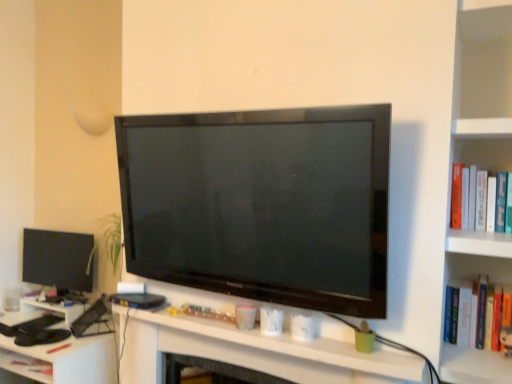
You are a GUI agent. You are given a task and a screenshot of the screen. Output one action in this format:
    pyautogui.click(x=<x>, y=<y>)
    Task: Click on the hardcover book at right
    This screenshot has height=384, width=512.
    Given the screenshot: What is the action you would take?
    pyautogui.click(x=480, y=201)

Measure the distance between point [57,376] and camera.

Point [57,376] and camera are 6.20 feet apart.

Where is `matte black computer at center`? matte black computer at center is located at coordinates (257, 352).

Between matte black monitor at left and white plastic computer desk at lower left, which one is positioned in front?

white plastic computer desk at lower left is more forward.

Between matte black monitor at left and white plastic computer desk at lower left, which one has more height?

white plastic computer desk at lower left is taller.

Is white plastic computer desk at lower left at the back of matte black monitor at left?

matte black monitor at left is not turned away from white plastic computer desk at lower left.

Looking at this image, from the image's perspective, is matte black monitor at left below white plastic computer desk at lower left?

No, from the image's perspective, matte black monitor at left is not below white plastic computer desk at lower left.

Is point (55, 256) behind point (485, 226)?

Yes, point (55, 256) is behind point (485, 226).

Which of these two, matte black monitor at left or hardcover book at right, stands taller?

matte black monitor at left is taller.

Is matte black monitor at left far away from hardcover book at right?

Yes, matte black monitor at left and hardcover book at right are located far from each other.

Considering the relative sizes of matte black monitor at left and hardcover book at right in the image provided, is matte black monitor at left smaller than hardcover book at right?

No, matte black monitor at left is not smaller than hardcover book at right.

Is white plastic computer desk at lower left with hardcover book at right?

There is a gap between white plastic computer desk at lower left and hardcover book at right.

Would you say hardcover book at right is part of white plastic computer desk at lower left's contents?

No, hardcover book at right is not a part of white plastic computer desk at lower left.

From the image's perspective, which is above, white plastic computer desk at lower left or hardcover book at right?

From the image's view, hardcover book at right is above.

Is hardcover book at right situated inside matte black computer at center or outside?

hardcover book at right is not inside matte black computer at center, it's outside.

From the picture: Is hardcover book at right further to camera compared to matte black computer at center?

Yes, hardcover book at right is further from the viewer.

Is matte black computer at center at the back of hardcover book at right?

No, matte black computer at center is not at the back of hardcover book at right.

At what (x,y) coordinates should I click in order to perform the action: click on computer on the left of hardcover book at right. Please return your answer as a coordinate pair (x, y). The image size is (512, 384). Looking at the image, I should click on (257, 352).

Who is taller, white plastic computer desk at lower left or matte black monitor at left?

white plastic computer desk at lower left.

In the scene shown: Which is closer to the camera, (89, 338) or (64, 251)?

Positioned in front is point (89, 338).

Does white plastic computer desk at lower left have a greater width compared to matte black monitor at left?

Correct, the width of white plastic computer desk at lower left exceeds that of matte black monitor at left.

What's the angular difference between white plastic computer desk at lower left and matte black monitor at left's facing directions?

The angle between the facing direction of white plastic computer desk at lower left and the facing direction of matte black monitor at left is 3.79 degrees.

In order to click on computer desk behind the matte black computer at center in this screenshot , I will do `click(63, 360)`.

Would you say white plastic computer desk at lower left is to the left or to the right of matte black computer at center in the picture?

In the image, white plastic computer desk at lower left appears on the left side of matte black computer at center.

Considering the positions of objects white plastic computer desk at lower left and matte black computer at center in the image provided, who is behind, white plastic computer desk at lower left or matte black computer at center?

white plastic computer desk at lower left is more distant.

Between hardcover book at right and white plastic computer desk at lower left, which one is positioned behind?

white plastic computer desk at lower left is more distant.

Can you confirm if hardcover book at right is positioned to the right of white plastic computer desk at lower left?

Correct, you'll find hardcover book at right to the right of white plastic computer desk at lower left.

Is hardcover book at right oriented away from white plastic computer desk at lower left?

hardcover book at right is not turned away from white plastic computer desk at lower left.

From a real-world perspective, who is located lower, hardcover book at right or white plastic computer desk at lower left?

white plastic computer desk at lower left, from a real-world perspective.

Where is `television located on the left of white plastic computer desk at lower left`? television located on the left of white plastic computer desk at lower left is located at coordinates (57, 259).

Locate an element on the screen. television behind the hardcover book at right is located at coordinates (57, 259).

Based on the photo, when comparing their distances from matte black computer at center, does matte black monitor at left or white plastic computer desk at lower left seem further?

The object further to matte black computer at center is matte black monitor at left.

Looking at the image, which one is located closer to matte black computer at center, matte black monitor at left or hardcover book at right?

hardcover book at right is positioned closer to the anchor matte black computer at center.

Looking at the image, which one is located further to white plastic computer desk at lower left, matte black computer at center or matte black monitor at left?

The object further to white plastic computer desk at lower left is matte black computer at center.

Which object lies nearer to the anchor point hardcover book at right, matte black monitor at left or matte black computer at center?

Based on the image, matte black computer at center appears to be nearer to hardcover book at right.

Which object lies nearer to the anchor point hardcover book at right, white plastic computer desk at lower left or matte black computer at center?

matte black computer at center lies closer to hardcover book at right than the other object.

Based on their spatial positions, is matte black computer at center or hardcover book at right further from matte black monitor at left?

Among the two, hardcover book at right is located further to matte black monitor at left.

From the image, which object appears to be nearer to white plastic computer desk at lower left, matte black monitor at left or matte black computer at center?

Among the two, matte black monitor at left is located nearer to white plastic computer desk at lower left.

From the image, which object appears to be nearer to hardcover book at right, matte black computer at center or white plastic computer desk at lower left?

Based on the image, matte black computer at center appears to be nearer to hardcover book at right.

The width and height of the screenshot is (512, 384). In order to click on computer desk located between matte black monitor at left and matte black computer at center in the left-right direction in this screenshot , I will do `click(63, 360)`.

This screenshot has height=384, width=512. Find the location of `computer between matte black monitor at left and hardcover book at right in the horizontal direction`. computer between matte black monitor at left and hardcover book at right in the horizontal direction is located at coordinates (257, 352).

This screenshot has height=384, width=512. Find the location of `computer between white plastic computer desk at lower left and hardcover book at right from left to right`. computer between white plastic computer desk at lower left and hardcover book at right from left to right is located at coordinates (257, 352).

This screenshot has height=384, width=512. In order to click on computer desk located between matte black monitor at left and hardcover book at right in the left-right direction in this screenshot , I will do `click(63, 360)`.